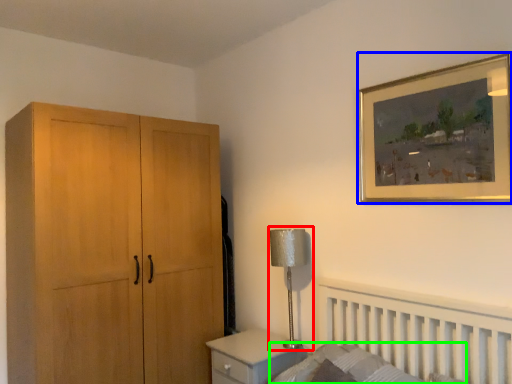
Question: Which is nearer to the table lamp (highlighted by a red box)? picture frame (highlighted by a blue box) or mattress (highlighted by a green box).

Choices:
 (A) picture frame
 (B) mattress

Answer: (B)